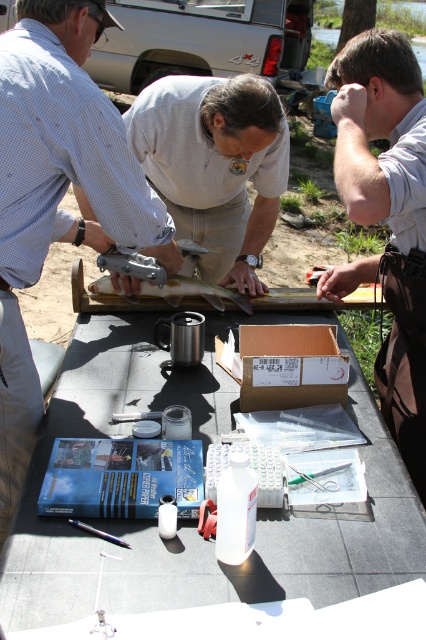
Question: Which point appears closest to the camera in this image?

Choices:
 (A) (11, 330)
 (B) (374, 422)
 (C) (416, 388)
 (D) (273, 369)

Answer: (A)

Question: Among these points, which one is nearest to the camera?

Choices:
 (A) (11, 250)
 (B) (58, 582)
 (C) (377, 29)
 (D) (281, 339)

Answer: (B)

Question: Does white apron at right come in front of brown cardboard box at center?

Choices:
 (A) yes
 (B) no

Answer: (A)

Question: Does white apron at right appear on the left side of brown cardboard box at center?

Choices:
 (A) no
 (B) yes

Answer: (A)

Question: Is gray rubber table at center to the right of white apron at right from the viewer's perspective?

Choices:
 (A) yes
 (B) no

Answer: (B)

Question: Which of these objects is positioned farthest from the white apron at right?

Choices:
 (A) brown cardboard box at center
 (B) matte black shirt at upper left

Answer: (B)